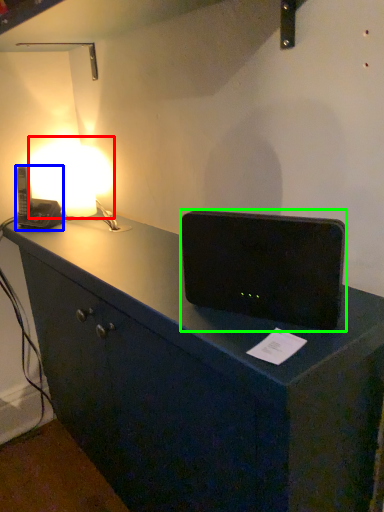
Question: Based on their relative distances, which object is nearer to lamp (highlighted by a red box)? Choose from gadget (highlighted by a blue box) and loudspeaker (highlighted by a green box).

Choices:
 (A) gadget
 (B) loudspeaker

Answer: (A)